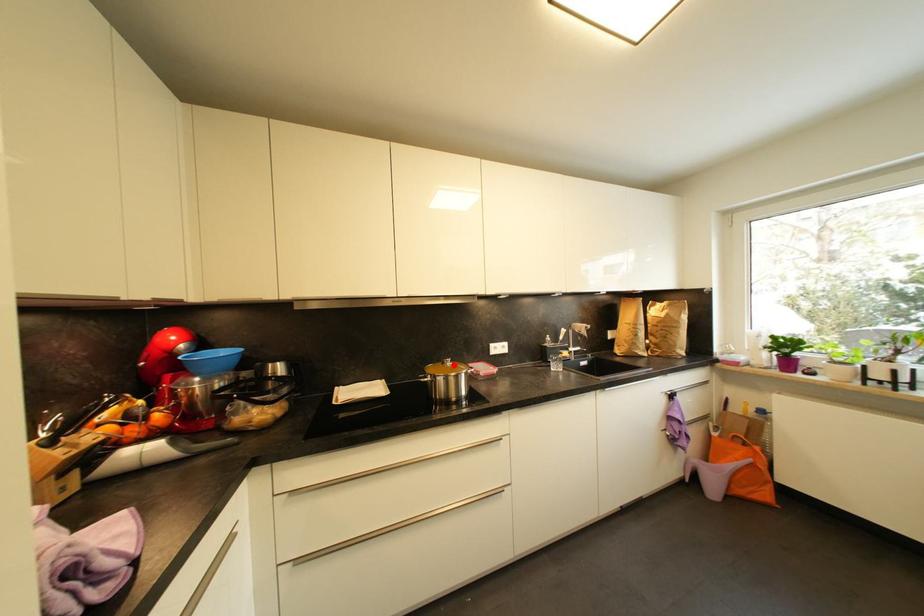
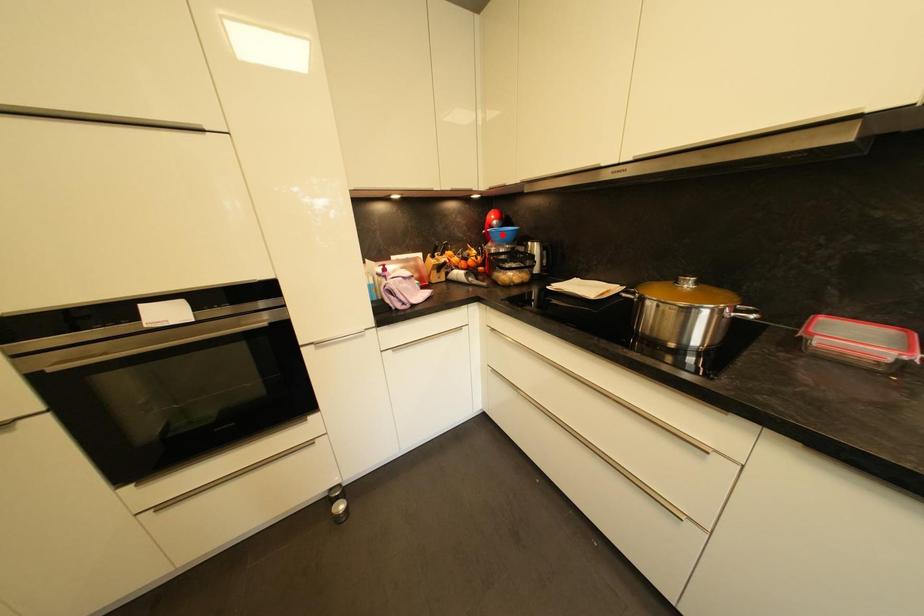
I am providing you with two images of the same scene from different viewpoints. A red point is marked on the first image and another point is marked on the second image. Are the points marked in image1 and image2 representing the same 3D position?

No